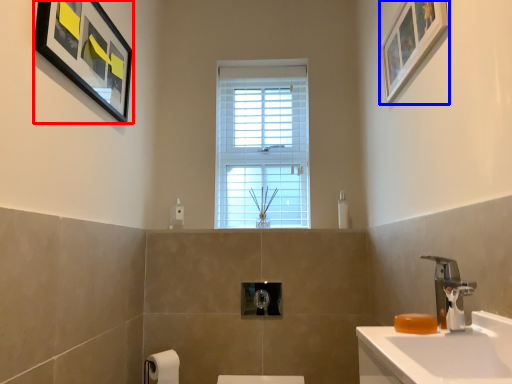
Question: Which point is closer to the camera, picture frame (highlighted by a red box) or picture frame (highlighted by a blue box)?

Choices:
 (A) picture frame
 (B) picture frame

Answer: (B)